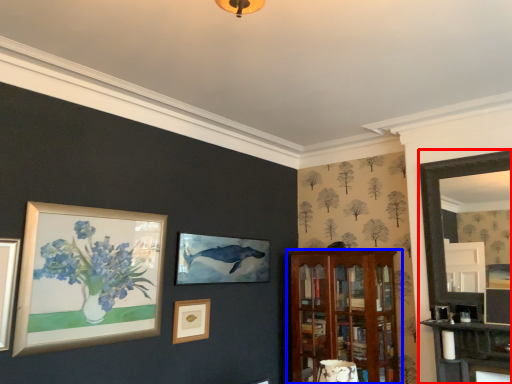
Question: Which object appears farthest to the camera in this image, fireplace (highlighted by a red box) or shelf (highlighted by a blue box)?

Choices:
 (A) fireplace
 (B) shelf

Answer: (B)